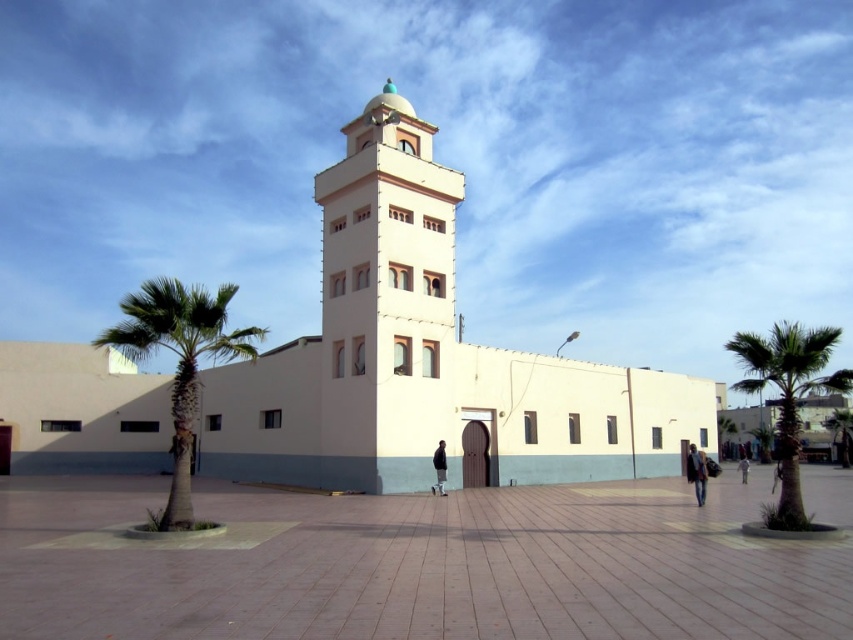
Can you confirm if dark gray jacket at center is shorter than light blue jeans at center?

Indeed, dark gray jacket at center has a lesser height compared to light blue jeans at center.

Who is more forward, (433,452) or (746,468)?

Point (433,452) is in front.

What do you see at coordinates (439, 468) in the screenshot? The height and width of the screenshot is (640, 853). I see `dark gray jacket at center` at bounding box center [439, 468].

Image resolution: width=853 pixels, height=640 pixels. In order to click on dark gray jacket at center in this screenshot , I will do `click(439, 468)`.

Who is more distant from viewer, (695, 493) or (746, 470)?

The point (746, 470) is more distant.

Does dark blue fabric jacket at lower right have a smaller size compared to light blue jeans at center?

Yes, dark blue fabric jacket at lower right is smaller than light blue jeans at center.

At what (x,y) coordinates should I click in order to perform the action: click on dark blue fabric jacket at lower right. Please return your answer as a coordinate pair (x, y). This screenshot has height=640, width=853. Looking at the image, I should click on (697, 472).

What are the coordinates of `dark blue fabric jacket at lower right` in the screenshot? It's located at (697, 472).

Which is below, light pink stucco bell tower at center or light blue jeans at center?

Positioned lower is light blue jeans at center.

Is light pink stucco bell tower at center to the right of light blue jeans at center from the viewer's perspective?

In fact, light pink stucco bell tower at center is to the left of light blue jeans at center.

Measure the distance between point (451, 300) and camera.

Point (451, 300) and camera are 25.45 meters apart.

Identify the location of light pink stucco bell tower at center. (387, 300).